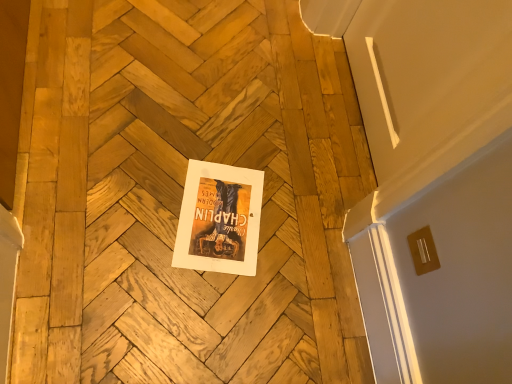
Locate an element on the screen. The width and height of the screenshot is (512, 384). vacant space situated above natural wood plywood at center (from a real-world perspective) is located at coordinates (164, 193).